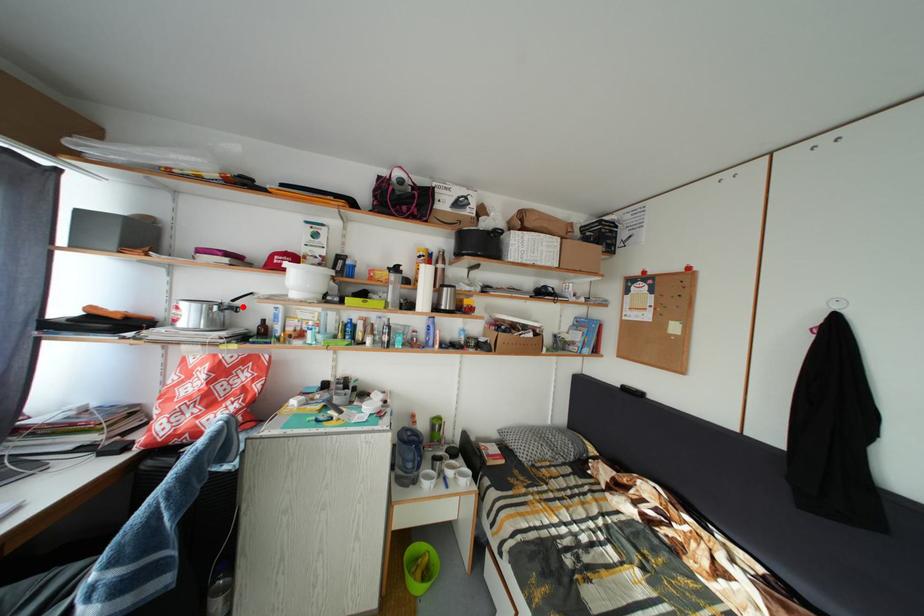
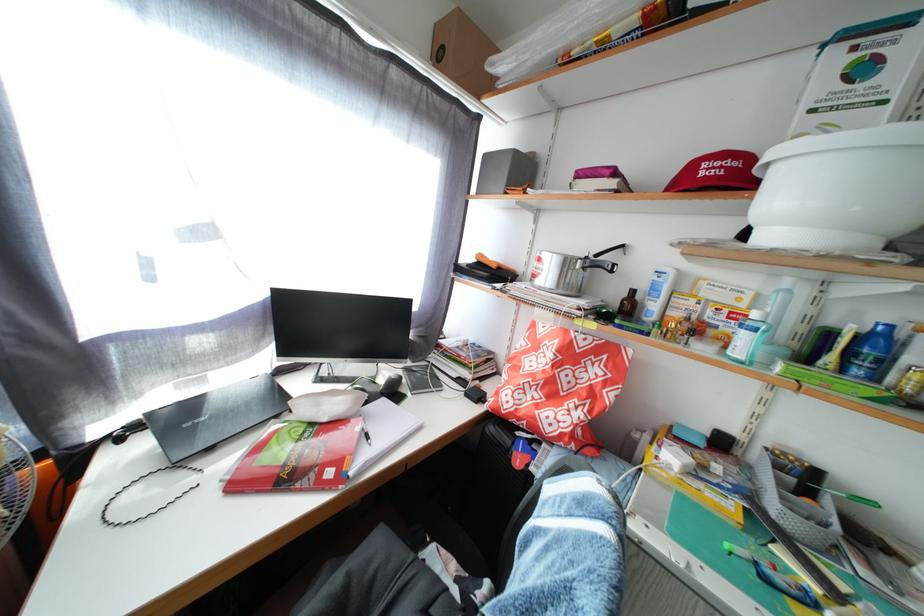
Find the pixel in the second image that matches the highlighted location in the first image.

(605, 262)